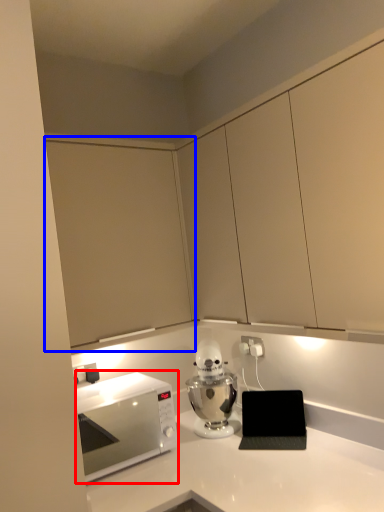
Question: Among these objects, which one is farthest to the camera, microwave oven (highlighted by a red box) or cabinetry (highlighted by a blue box)?

Choices:
 (A) microwave oven
 (B) cabinetry

Answer: (B)